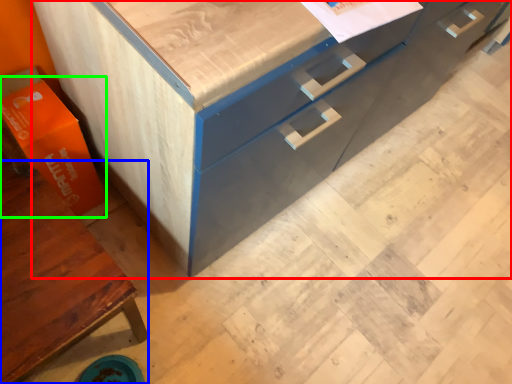
Question: Based on their relative distances, which object is farther from chest of drawers (highlighted by a red box)? Choose from cabinetry (highlighted by a blue box) and cardboard box (highlighted by a green box).

Choices:
 (A) cabinetry
 (B) cardboard box

Answer: (A)